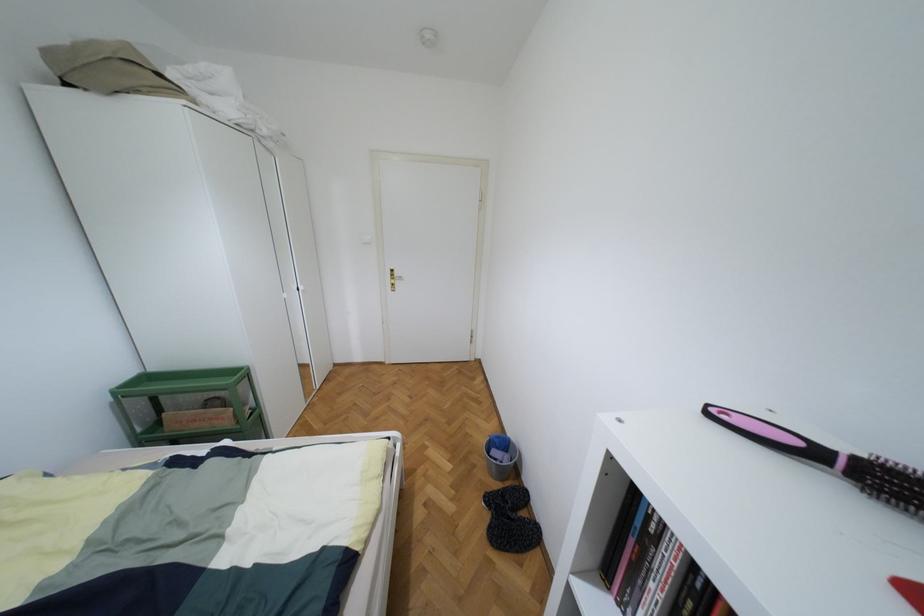
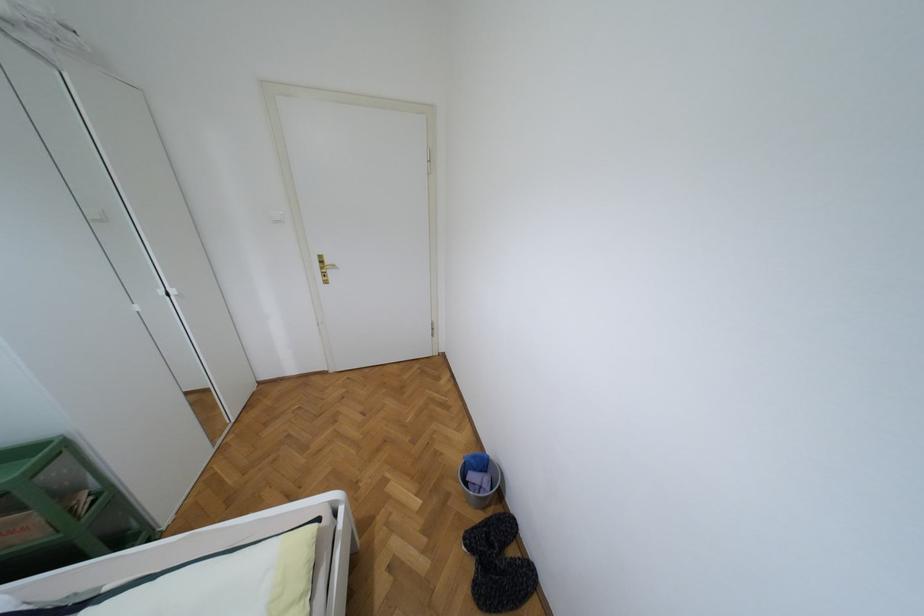
Question: Based on the continuous images, in which direction is the camera rotating? Reply with the corresponding letter.

Choices:
 (A) Left
 (B) Right
 (C) Up
 (D) Down

Answer: (B)